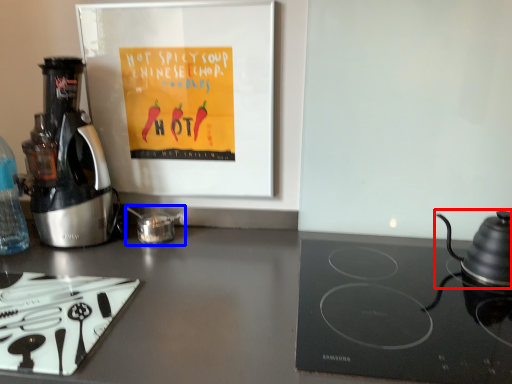
Question: Among these objects, which one is farthest to the camera, kitchen appliance (highlighted by a red box) or tea pot (highlighted by a blue box)?

Choices:
 (A) kitchen appliance
 (B) tea pot

Answer: (B)